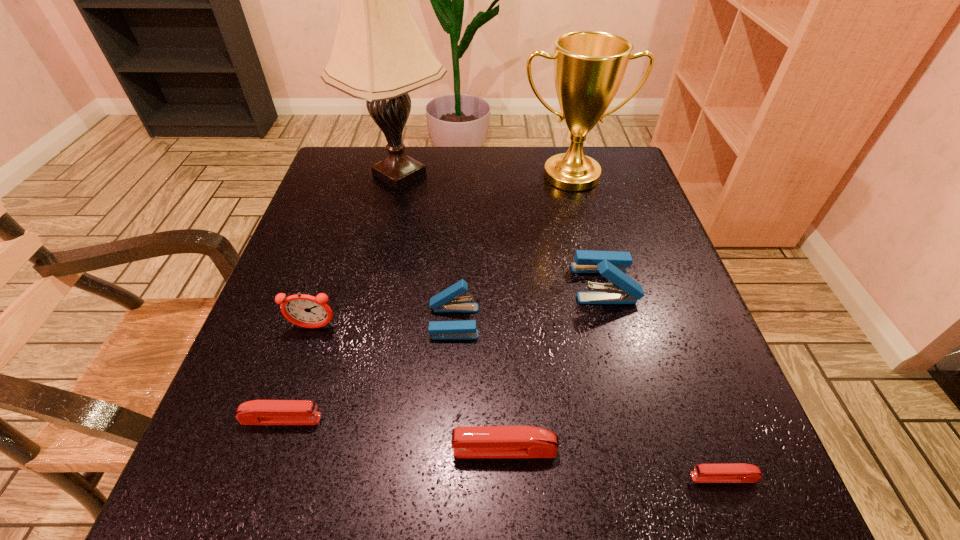
Locate an element on the screen. This screenshot has width=960, height=540. alarm clock that is at the left edge is located at coordinates (303, 310).

Find the location of `stapler present at the left edge`. stapler present at the left edge is located at coordinates (256, 412).

Where is `award at the right edge`? The image size is (960, 540). award at the right edge is located at coordinates (589, 66).

Locate an element on the screen. object present at the far left corner is located at coordinates (379, 54).

Locate an element on the screen. The image size is (960, 540). object located at the far right corner is located at coordinates (589, 66).

I want to click on object positioned at the near right corner, so click(x=735, y=472).

Image resolution: width=960 pixels, height=540 pixels. In order to click on blank area at the far edge in this screenshot , I will do `click(433, 184)`.

This screenshot has width=960, height=540. What are the coordinates of `blank space at the near edge` in the screenshot? It's located at (576, 510).

The width and height of the screenshot is (960, 540). In the image, there is a desktop. Find the location of `free space at the left edge`. free space at the left edge is located at coordinates (311, 204).

Find the location of a particular element. This screenshot has height=540, width=960. free space at the right edge of the desktop is located at coordinates (657, 299).